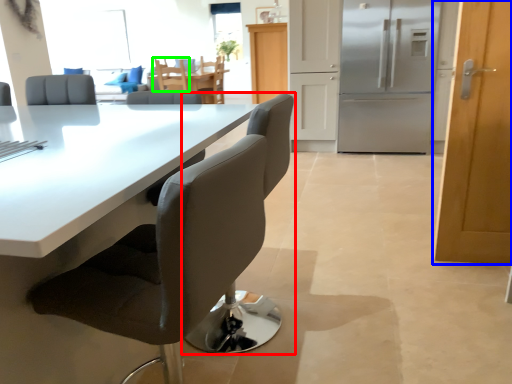
Question: Considering the real-world distances, which object is farthest from chair (highlighted by a red box)? door (highlighted by a blue box) or chair (highlighted by a green box)?

Choices:
 (A) door
 (B) chair

Answer: (B)